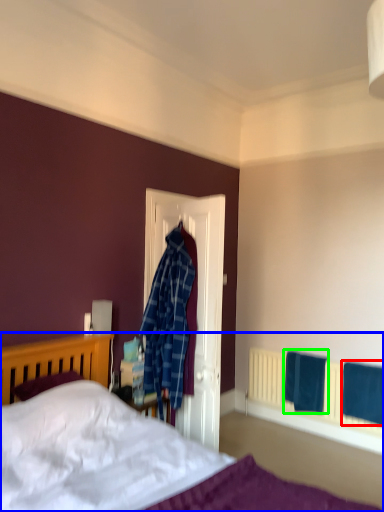
Question: Estimate the real-world distances between objects in this image. Which object is closer to bath towel (highlighted by a red box), bed (highlighted by a blue box) or bath towel (highlighted by a green box)?

Choices:
 (A) bed
 (B) bath towel

Answer: (A)